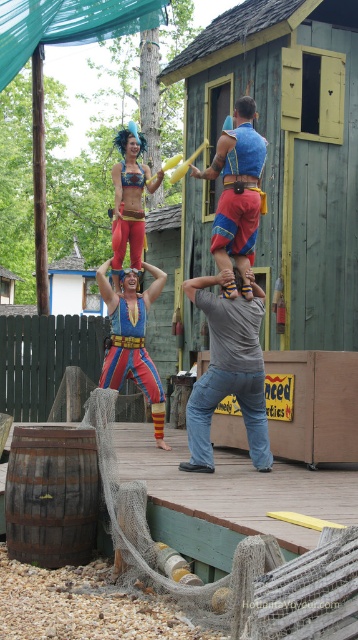
You are a photographer trying to capture a clear shot of both the blue fabric at center and the shiny metallic bikini top at upper center. Based on their positions, which object would you need to focus on first to ensure both are in frame?

The blue fabric at center is much taller than the shiny metallic bikini top at upper center, so you should focus on the blue fabric at center first to ensure both are in frame.

You are standing at the camera position and want to reach the point marked at coordinates point (115, 218). If you walk straight towards it, how far will you have to walk?

You will have to walk 34.30 feet to reach the point marked at coordinates point (115, 218) from the camera position.

You are a photographer at the circus performance. You want to capture a photo that shows the blue fabric at center and the shiny metallic bikini top at upper center in the same frame. Based on their positions, which object should you focus on first to ensure both are in focus?

The blue fabric at center is positioned under the shiny metallic bikini top at upper center, so you should focus on the shiny metallic bikini top at upper center first to ensure both are in focus.